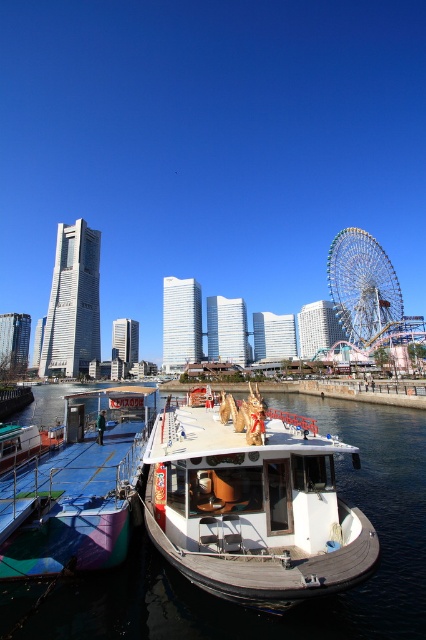
You are standing on the dock and want to take a photo of the metallic silver ferris wheel at right without the white matte boat at center blocking it. Which direction should you move to ensure the boat is out of the frame?

Move to the left side of the dock so that the white matte boat at center is no longer blocking the view of the metallic silver ferris wheel at right.

You are standing on the dock and want to take a photo of the metallic silver ferris wheel at right without the multicolored painted boat at lower left blocking the view. Is it possible to do so?

The multicolored painted boat at lower left is positioned under the metallic silver ferris wheel at right, so if you move to a higher vantage point or angle your camera upwards, you can capture the ferris wheel without the boat obstructing the view.

You are planning to board a boat that can accommodate more passengers. Based on the scene, which boat between the white matte boat at center and the multicolored painted boat at lower left would you choose?

The multicolored painted boat at lower left is larger in size compared to the white matte boat at center, so it can accommodate more passengers.